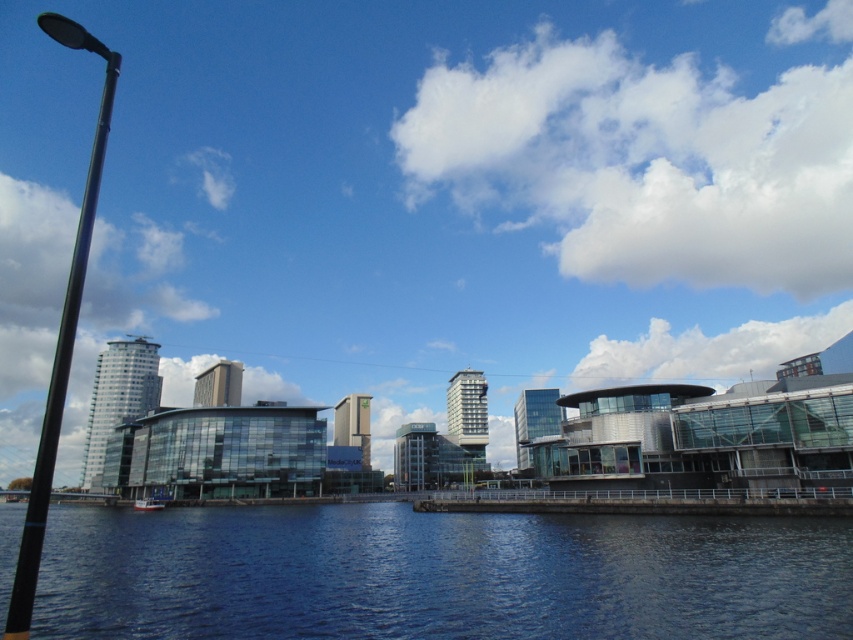
Does black metal pole at left have a greater width compared to white plastic boat at lower left?

Yes.

Who is taller, black metal pole at left or white plastic boat at lower left?

With more height is black metal pole at left.

This screenshot has width=853, height=640. Describe the element at coordinates (61, 333) in the screenshot. I see `black metal pole at left` at that location.

Where is `black metal pole at left`? The height and width of the screenshot is (640, 853). black metal pole at left is located at coordinates (61, 333).

Who is lower down, blue glassy water at lower center or black metal pole at left?

Positioned lower is blue glassy water at lower center.

Which is in front, point (399, 564) or point (57, 355)?

Point (57, 355)

The height and width of the screenshot is (640, 853). Identify the location of blue glassy water at lower center. (437, 573).

Find the location of a particular element. blue glassy water at lower center is located at coordinates (437, 573).

Is point (129, 598) positioned behind point (141, 506)?

No.

Between blue glassy water at lower center and white plastic boat at lower left, which one appears on the right side from the viewer's perspective?

blue glassy water at lower center

Is point (746, 563) farther from viewer compared to point (142, 499)?

No, (746, 563) is closer to viewer.

Image resolution: width=853 pixels, height=640 pixels. Identify the location of blue glassy water at lower center. (437, 573).